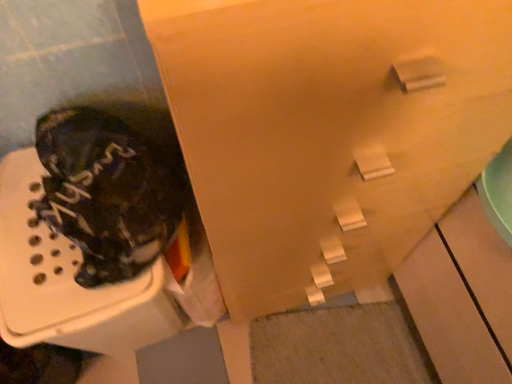
Locate an element on the screen. matte wood cabinet at upper center is located at coordinates (328, 131).

What do you see at coordinates (328, 131) in the screenshot?
I see `matte wood cabinet at upper center` at bounding box center [328, 131].

What is the approximate width of matte wood cabinet at upper center?

Result: matte wood cabinet at upper center is 15.08 inches in width.

Measure the distance between point (234, 277) and camera.

They are 32.48 inches apart.

Where is `camouflage fabric boot at left`? Image resolution: width=512 pixels, height=384 pixels. camouflage fabric boot at left is located at coordinates (106, 192).

This screenshot has height=384, width=512. Describe the element at coordinates (106, 192) in the screenshot. I see `camouflage fabric boot at left` at that location.

Where is `matte wood cabinet at upper center`? Image resolution: width=512 pixels, height=384 pixels. matte wood cabinet at upper center is located at coordinates (328, 131).

In the image, is matte wood cabinet at upper center on the left side or the right side of camouflage fabric boot at left?

Clearly, matte wood cabinet at upper center is on the right of camouflage fabric boot at left in the image.

Is matte wood cabinet at upper center further to camera compared to camouflage fabric boot at left?

No, it is not.

Between point (339, 181) and point (147, 200), which one is positioned behind?

The point (147, 200) is farther from the camera.

From the image's perspective, is matte wood cabinet at upper center below camouflage fabric boot at left?

No, from the image's perspective, matte wood cabinet at upper center is not below camouflage fabric boot at left.

From a real-world perspective, which is physically below, matte wood cabinet at upper center or camouflage fabric boot at left?

In real-world perspective, matte wood cabinet at upper center is lower.

Is matte wood cabinet at upper center wider than camouflage fabric boot at left?

Yes.

From their relative heights in the image, would you say matte wood cabinet at upper center is taller or shorter than camouflage fabric boot at left?

In the image, matte wood cabinet at upper center appears to be taller than camouflage fabric boot at left.

Considering the relative sizes of matte wood cabinet at upper center and camouflage fabric boot at left in the image provided, is matte wood cabinet at upper center smaller than camouflage fabric boot at left?

Incorrect, matte wood cabinet at upper center is not smaller in size than camouflage fabric boot at left.

Is camouflage fabric boot at left inside matte wood cabinet at upper center?

That's incorrect, camouflage fabric boot at left is not inside matte wood cabinet at upper center.

Are matte wood cabinet at upper center and camouflage fabric boot at left beside each other?

No, matte wood cabinet at upper center is not in contact with camouflage fabric boot at left.

Is camouflage fabric boot at left at the back of matte wood cabinet at upper center?

No, matte wood cabinet at upper center's orientation is not away from camouflage fabric boot at left.

How many degrees apart are the facing directions of matte wood cabinet at upper center and camouflage fabric boot at left?

The angular difference between matte wood cabinet at upper center and camouflage fabric boot at left is 2.66 degrees.

This screenshot has height=384, width=512. Find the location of `cabinetry in front of the camouflage fabric boot at left`. cabinetry in front of the camouflage fabric boot at left is located at coordinates (328, 131).

Considering the positions of objects camouflage fabric boot at left and matte wood cabinet at upper center in the image provided, who is more to the right, camouflage fabric boot at left or matte wood cabinet at upper center?

matte wood cabinet at upper center is more to the right.

Based on the photo, considering the positions of objects camouflage fabric boot at left and matte wood cabinet at upper center in the image provided, who is in front, camouflage fabric boot at left or matte wood cabinet at upper center?

matte wood cabinet at upper center is in front.

Considering the points (140, 264) and (195, 58), which point is in front, point (140, 264) or point (195, 58)?

The point (195, 58) is closer to the camera.

Based on the photo, from the image's perspective, between camouflage fabric boot at left and matte wood cabinet at upper center, who is located below?

camouflage fabric boot at left.

From a real-world perspective, which object stands above the other?

camouflage fabric boot at left, from a real-world perspective.

Which of these two, camouflage fabric boot at left or matte wood cabinet at upper center, is thinner?

camouflage fabric boot at left is thinner.

Considering the sizes of objects camouflage fabric boot at left and matte wood cabinet at upper center in the image provided, who is taller, camouflage fabric boot at left or matte wood cabinet at upper center?

Standing taller between the two is matte wood cabinet at upper center.

Who is smaller, camouflage fabric boot at left or matte wood cabinet at upper center?

Smaller between the two is camouflage fabric boot at left.

Can we say camouflage fabric boot at left lies outside matte wood cabinet at upper center?

That's correct, camouflage fabric boot at left is outside of matte wood cabinet at upper center.

Would you consider camouflage fabric boot at left to be distant from matte wood cabinet at upper center?

No, there isn't a large distance between camouflage fabric boot at left and matte wood cabinet at upper center.

Is camouflage fabric boot at left facing away from matte wood cabinet at upper center?

camouflage fabric boot at left does not have its back to matte wood cabinet at upper center.

What's the angular difference between camouflage fabric boot at left and matte wood cabinet at upper center's facing directions?

camouflage fabric boot at left and matte wood cabinet at upper center are facing 2.66 degrees away from each other.

How distant is camouflage fabric boot at left from matte wood cabinet at upper center?

camouflage fabric boot at left is 11.82 inches from matte wood cabinet at upper center.

At what (x,y) coordinates should I click in order to perform the action: click on cabinetry that appears above the camouflage fabric boot at left (from the image's perspective). Please return your answer as a coordinate pair (x, y). The image size is (512, 384). Looking at the image, I should click on (328, 131).

This screenshot has width=512, height=384. What are the coordinates of `cabinetry that is on the right side of camouflage fabric boot at left` in the screenshot? It's located at [x=328, y=131].

Locate an element on the screen. footwear lying below the matte wood cabinet at upper center (from the image's perspective) is located at coordinates pos(106,192).